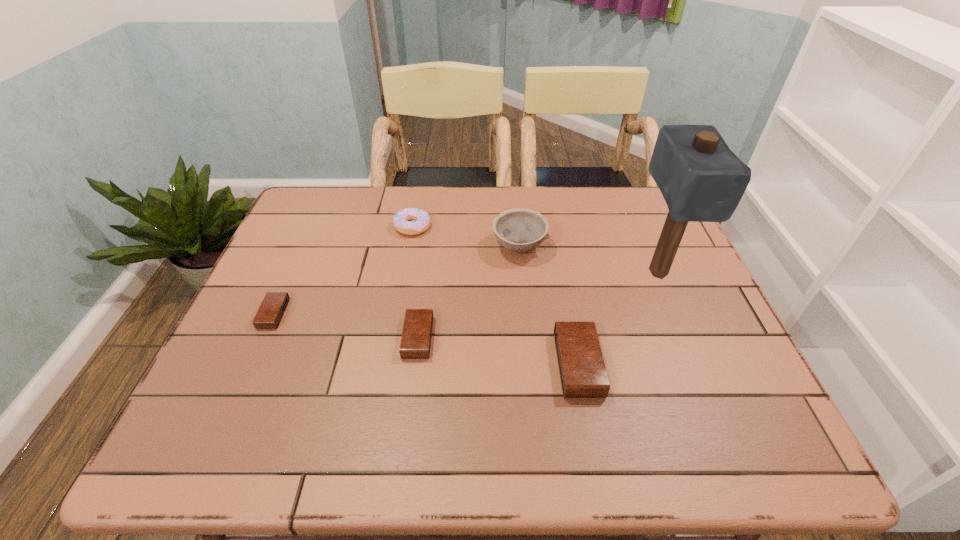
I want to click on the shortest object, so click(x=272, y=308).

Locate an element on the screen. The image size is (960, 540). the leftmost object is located at coordinates (272, 308).

This screenshot has height=540, width=960. I want to click on the second shortest object, so click(x=415, y=343).

The height and width of the screenshot is (540, 960). Identify the location of the second alarm clock from left to right. (415, 343).

Locate an element on the screen. Image resolution: width=960 pixels, height=540 pixels. the tallest alarm clock is located at coordinates (583, 374).

Identify the location of the second tallest object. The height and width of the screenshot is (540, 960). (520, 230).

Find the location of `doughnut`. doughnut is located at coordinates (402, 220).

You are a GUI agent. You are given a task and a screenshot of the screen. Output one action in this format:
    pyautogui.click(x=<x>, y=<y>)
    Task: Click on the mallet
    This screenshot has height=540, width=960.
    Given the screenshot: What is the action you would take?
    pyautogui.click(x=701, y=179)

Identify the location of the tallest object. The width and height of the screenshot is (960, 540). (701, 179).

Locate an element on the screen. This screenshot has height=540, width=960. vacant space located on the front face of the shortest alarm clock is located at coordinates (416, 314).